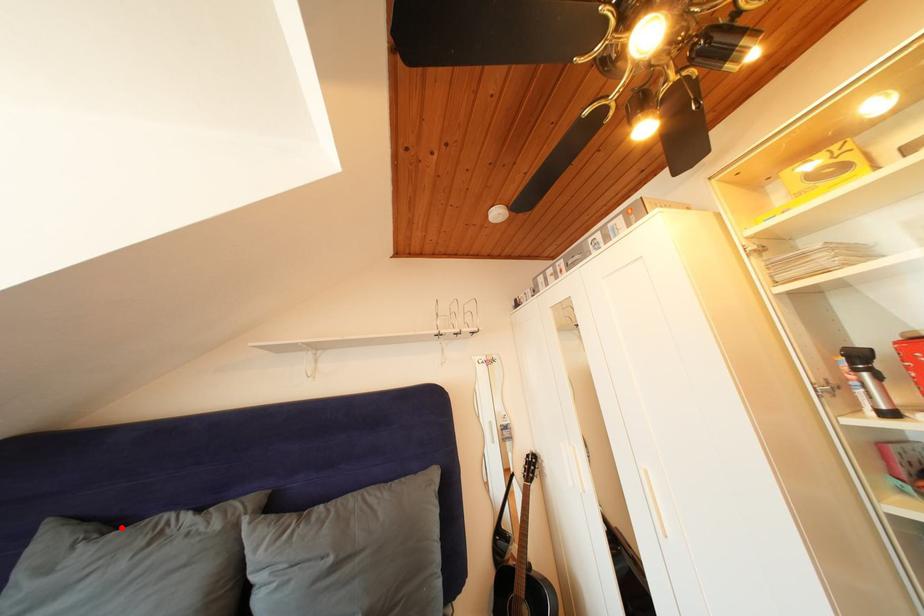
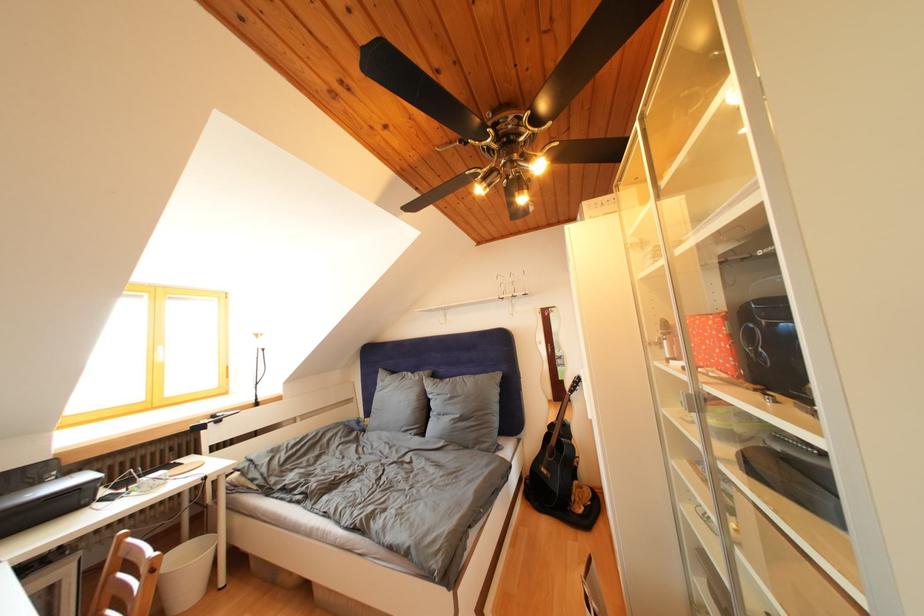
The point at the highlighted location is marked in the first image. Where is the corresponding point in the second image?

(400, 378)